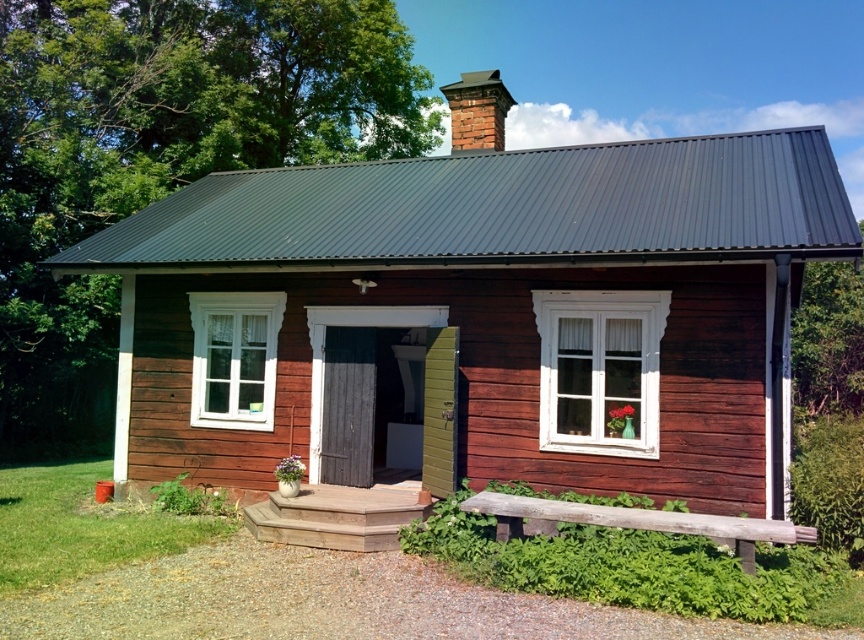
Question: Which object appears farthest from the camera in this image?

Choices:
 (A) smooth wooden cottage at center
 (B) red brick chimney at upper center

Answer: (B)

Question: Does smooth wooden cottage at center appear under red brick chimney at upper center?

Choices:
 (A) no
 (B) yes

Answer: (B)

Question: Can you confirm if smooth wooden cottage at center is positioned to the left of red brick chimney at upper center?

Choices:
 (A) yes
 (B) no

Answer: (A)

Question: Which of the following is the closest to the observer?

Choices:
 (A) (477, 136)
 (B) (767, 445)

Answer: (B)

Question: Does smooth wooden cottage at center come in front of red brick chimney at upper center?

Choices:
 (A) yes
 (B) no

Answer: (A)

Question: Which point appears farthest from the camera in this image?

Choices:
 (A) (128, 365)
 (B) (472, 99)

Answer: (B)